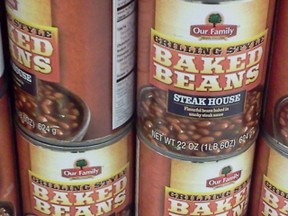
The height and width of the screenshot is (216, 288). What are the coordinates of `bowl of beans` in the screenshot? It's located at (52, 113), (172, 126), (285, 119).